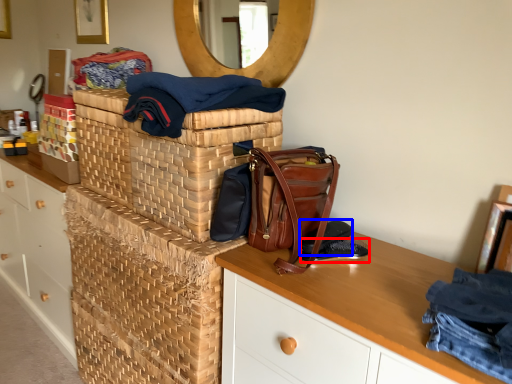
Question: Which object is closer to the camera taking this photo, shoe (highlighted by a red box) or shoe (highlighted by a blue box)?

Choices:
 (A) shoe
 (B) shoe

Answer: (B)